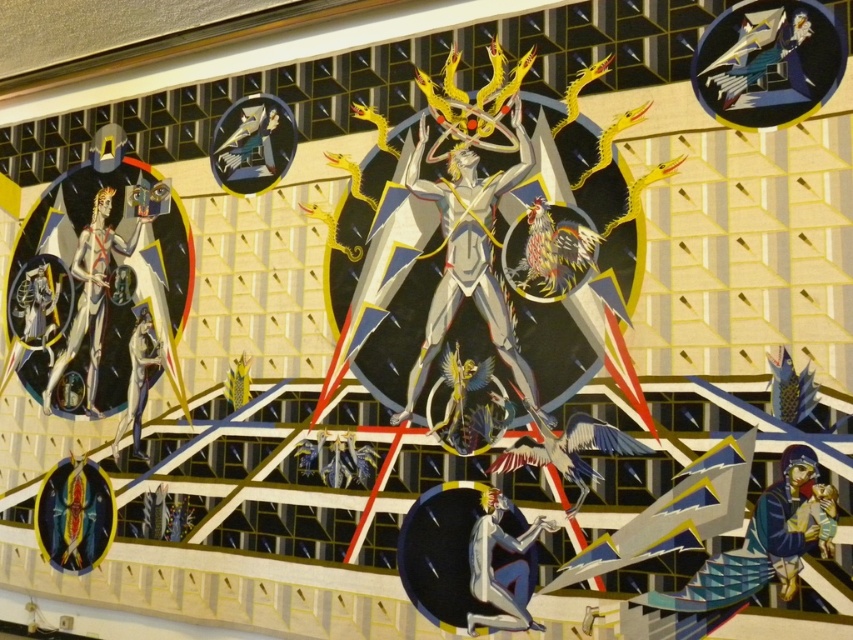
Question: Which point is farther from the camera taking this photo?

Choices:
 (A) (474, 211)
 (B) (149, 352)

Answer: (B)

Question: Which object appears farthest from the camera in this image?

Choices:
 (A) smooth white figure at lower center
 (B) smooth white figure at left
 (C) smooth silver figure at lower left
 (D) gold textured fabric at lower right

Answer: (B)

Question: Can you confirm if metallic silver figure at center is wider than smooth white figure at left?

Choices:
 (A) no
 (B) yes

Answer: (A)

Question: Which point appears farthest from the camera in this image?

Choices:
 (A) (408, 419)
 (B) (106, 289)
 (C) (141, 337)
 (D) (796, 506)

Answer: (B)

Question: Does metallic silver figure at center appear on the right side of smooth silver figure at lower left?

Choices:
 (A) yes
 (B) no

Answer: (A)

Question: Is metallic silver figure at center thinner than gold textured fabric at lower right?

Choices:
 (A) yes
 (B) no

Answer: (B)